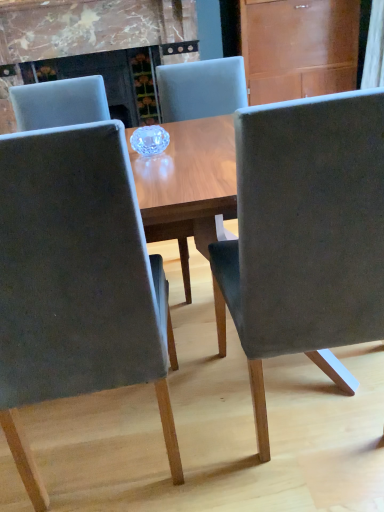
Where is `free spot to the right of velvet gray chair at center, the first chair from the left`? The width and height of the screenshot is (384, 512). free spot to the right of velvet gray chair at center, the first chair from the left is located at coordinates (x=216, y=429).